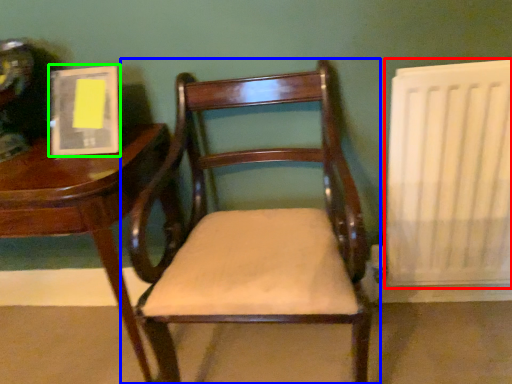
Question: Which object is the closest to the radiator (highlighted by a red box)? Choose among these: chair (highlighted by a blue box) or book (highlighted by a green box).

Choices:
 (A) chair
 (B) book

Answer: (A)